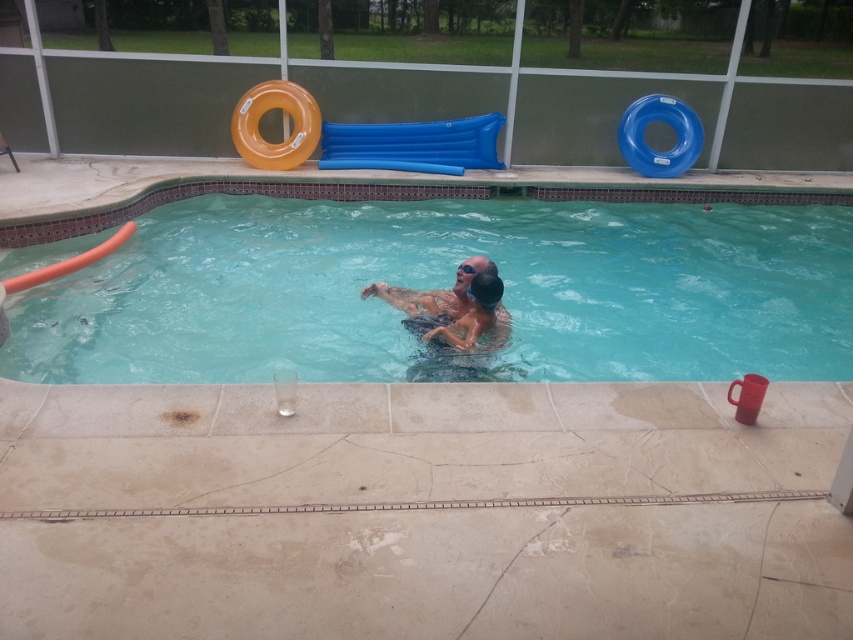
You are a lifeguard at the pool. You need to place a new black rubber swim cap at center and an orange rubber slide at upper left on the pool deck. The swim cap must be placed in a spot where it won

The black rubber swim cap at center has a smaller size compared to the orange rubber slide at upper left, so it can be placed in a smaller area or closer to the slide without taking up too much space.

You are a lifeguard who needs to place a 30cm tall first aid kit on the pool deck. The kit must be placed on an object that is taller than 25cm. Which object among the clear plastic pool at center and orange rubber slide at upper left can you place it on?

The clear plastic pool at center is taller than orange rubber slide at upper left, so you can place the first aid kit on the clear plastic pool at center since it is taller than 25cm.

You are a lifeguard at the pool and need to determine the safest area to place a floating toy. Considering the clear plastic pool at center and the blue inflatable slide at upper center, which object is taller and therefore might pose a risk if the toy is placed near it?

The clear plastic pool at center is much taller than the blue inflatable slide at upper center, so placing the floating toy near the clear plastic pool at center might pose a greater risk due to its height.